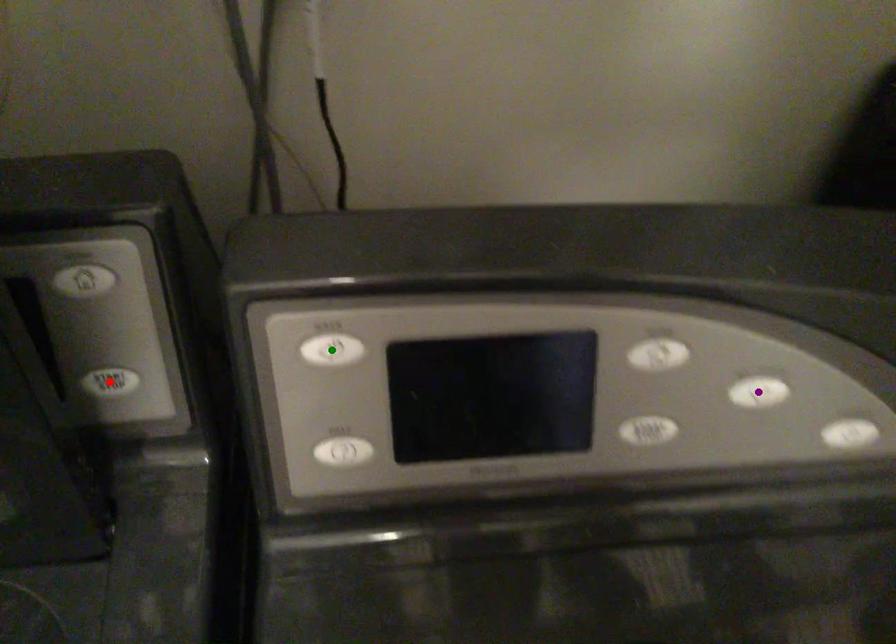
Order these from nearest to farthest:
A) red point
B) green point
C) purple point

green point, purple point, red point